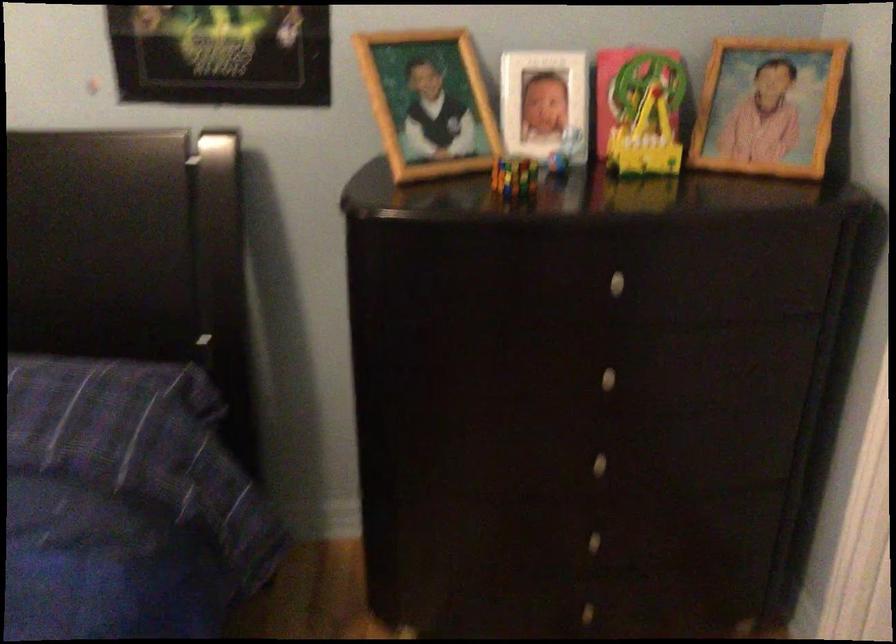
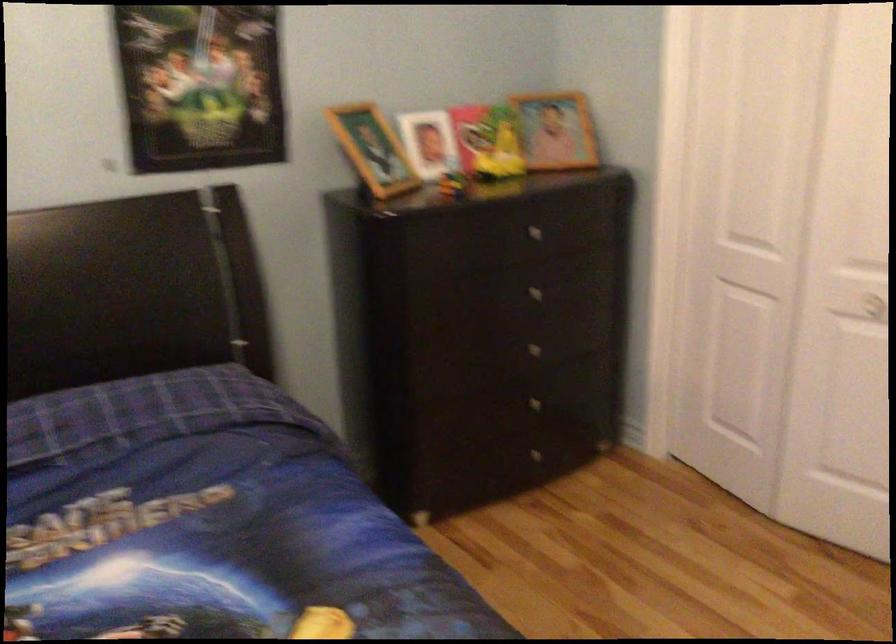
The point at (574, 536) is marked in the first image. Where is the corresponding point in the second image?

(528, 406)